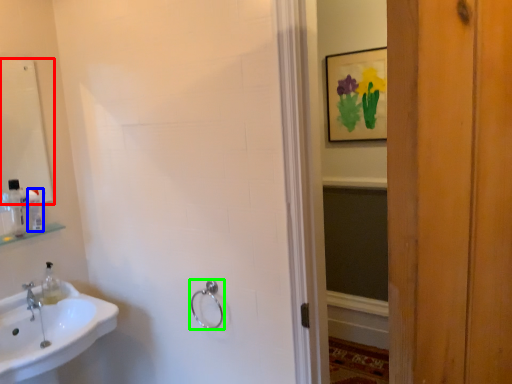
Question: Which object is the closest to the mirror (highlighted by a red box)? Choose among these: toiletry (highlighted by a blue box) or towel rack (highlighted by a green box).

Choices:
 (A) toiletry
 (B) towel rack

Answer: (A)